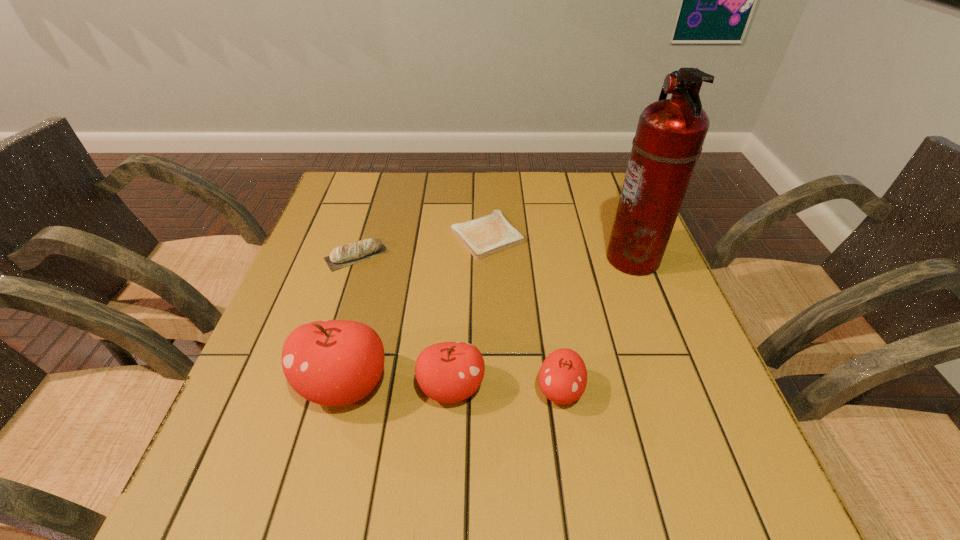
Where is `vacant space positioned 0.100m on the back of the leftmost apple`? vacant space positioned 0.100m on the back of the leftmost apple is located at coordinates (363, 316).

The image size is (960, 540). Find the location of `vacant point located 0.300m on the back of the second shortest apple`. vacant point located 0.300m on the back of the second shortest apple is located at coordinates tap(458, 264).

The height and width of the screenshot is (540, 960). Identify the location of vacant space situated 0.170m on the left of the rightmost apple. (445, 391).

This screenshot has height=540, width=960. In order to click on free space located 0.050m on the back of the toast in this screenshot , I will do `click(487, 204)`.

The image size is (960, 540). Identify the location of free space located 0.060m on the front of the fifth tallest object. (346, 289).

You are a GUI agent. You are given a task and a screenshot of the screen. Output one action in this format:
    pyautogui.click(x=<x>, y=<y>)
    Task: Click on the vacant region located 0.370m on the nozzle side of the tallest object
    Image resolution: width=960 pixels, height=540 pixels.
    Given the screenshot: What is the action you would take?
    pyautogui.click(x=458, y=258)

Identify the location of vacant area situated 0.100m on the nozzle side of the tallest object. (565, 258).

Where is `free space located 0.280m on the nozzle side of the tallest object`? free space located 0.280m on the nozzle side of the tallest object is located at coordinates (493, 258).

Identify the location of object present at the far edge. (492, 233).

Identify the location of apple that is at the left edge. Image resolution: width=960 pixels, height=540 pixels. (331, 362).